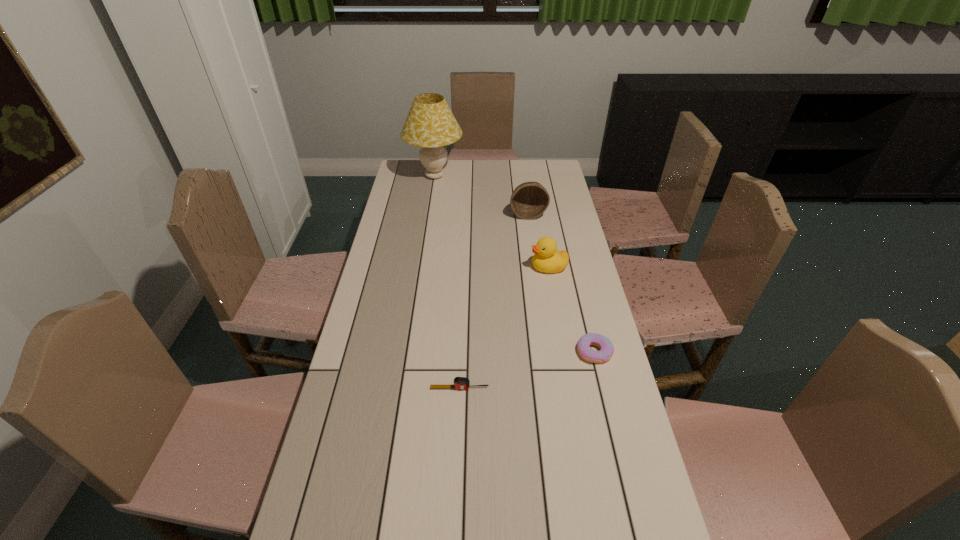
Identify the location of free region located 0.200m at the beak of the third nearest object. (475, 267).

Identify the location of free location located at the beak of the third nearest object. The height and width of the screenshot is (540, 960). (492, 267).

Where is `free space located at the beak of the third nearest object`? This screenshot has width=960, height=540. free space located at the beak of the third nearest object is located at coordinates (468, 267).

Find the location of a particular element. free space located 0.310m on the back of the nearest object is located at coordinates (463, 307).

What are the coordinates of `vacant space located on the front of the second nearest object` in the screenshot? It's located at (612, 424).

At what (x,y) coordinates should I click in order to perform the action: click on object that is at the far edge. Please return your answer as a coordinate pair (x, y). Looking at the image, I should click on (430, 124).

This screenshot has width=960, height=540. Identify the location of object that is at the left edge. (430, 124).

The height and width of the screenshot is (540, 960). I want to click on bowl at the right edge, so pyautogui.click(x=529, y=200).

Image resolution: width=960 pixels, height=540 pixels. Find the location of `duck that is positioned at the right edge`. duck that is positioned at the right edge is located at coordinates (547, 259).

Locate an element on the screen. This screenshot has height=540, width=960. doughnut positioned at the right edge is located at coordinates (606, 347).